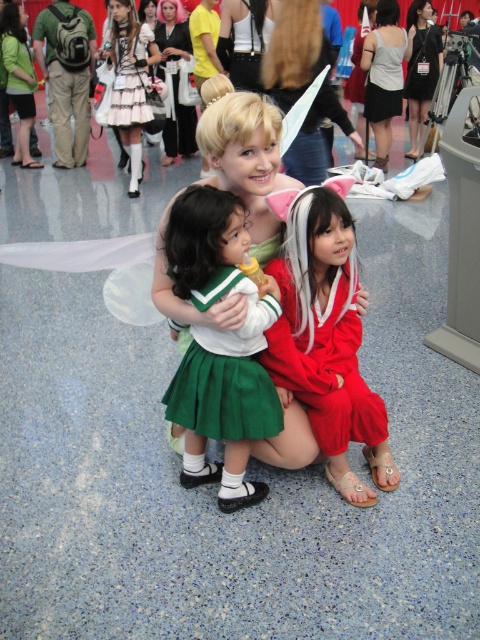
Question: Does green satin skirt at center lie in front of white lace dress at upper left?

Choices:
 (A) yes
 (B) no

Answer: (A)

Question: Which point appears closest to the camera in this image?

Choices:
 (A) (315, 333)
 (B) (268, 298)
 (C) (113, 10)
 (D) (124, 128)

Answer: (B)

Question: Which object is positioned closest to the matte red dress at center?

Choices:
 (A) matte black dress at upper left
 (B) green satin skirt at center

Answer: (B)

Question: Is matte red dress at center above white lace dress at upper left?

Choices:
 (A) yes
 (B) no

Answer: (B)

Question: Which is nearer to the green satin skirt at center?

Choices:
 (A) matte red dress at center
 (B) white lace dress at upper left
 (C) matte black dress at upper left

Answer: (A)

Question: Can you confirm if matte red dress at center is thinner than green satin skirt at center?

Choices:
 (A) no
 (B) yes

Answer: (A)